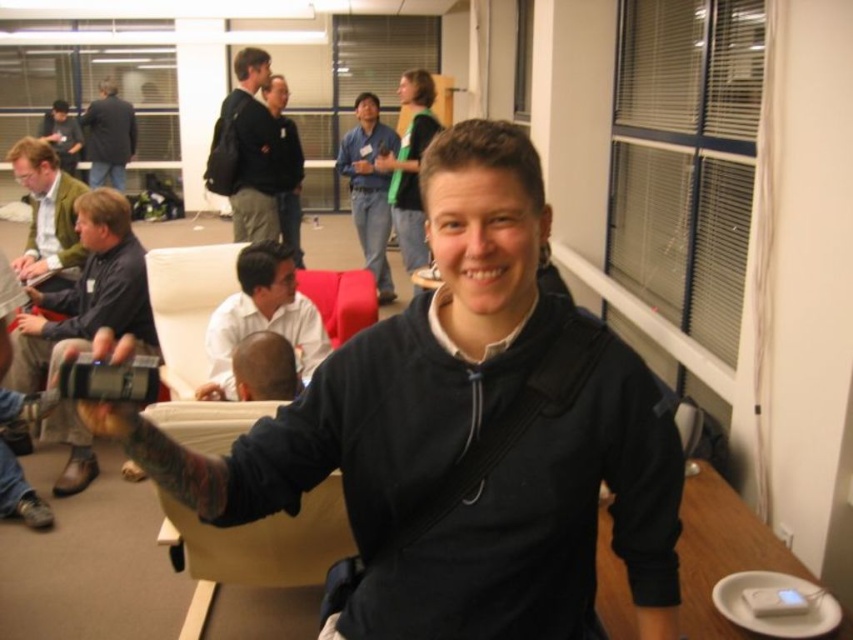
Which of these two, white glossy plate at lower right or blue shirt at center, stands taller?

With more height is blue shirt at center.

How distant is white glossy plate at lower right from blue shirt at center?

They are 12.80 feet apart.

The image size is (853, 640). Identify the location of white glossy plate at lower right. (721, 552).

Find the location of a particular element. The image size is (853, 640). white glossy plate at lower right is located at coordinates (721, 552).

Is matte black camera at left positioned behind blue shirt at center?

That is False.

Is point (45, 376) less distant than point (381, 221)?

Yes, it is.

Where is `matte black camera at left`? Image resolution: width=853 pixels, height=640 pixels. matte black camera at left is located at coordinates (88, 294).

Does point (254, 282) come behind point (289, 134)?

No, (254, 282) is closer to viewer.

Is white shirt at center smaller than black matte jacket at center?

Yes.

Does point (224, 300) come closer to viewer compared to point (288, 200)?

Yes, point (224, 300) is closer to viewer.

Where is `white shirt at center`? Image resolution: width=853 pixels, height=640 pixels. white shirt at center is located at coordinates (262, 317).